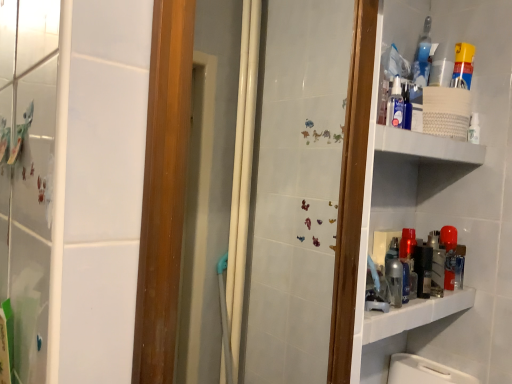
Question: Is yellow plastic spray can at upper right a part of white textured shelf at upper right?

Choices:
 (A) no
 (B) yes

Answer: (A)

Question: Is the depth of white textured shelf at upper right greater than that of yellow plastic spray can at upper right?

Choices:
 (A) no
 (B) yes

Answer: (A)

Question: From the image's perspective, would you say white textured shelf at upper right is shown under yellow plastic spray can at upper right?

Choices:
 (A) no
 (B) yes

Answer: (B)

Question: Considering the relative sizes of white textured shelf at upper right and yellow plastic spray can at upper right in the image provided, is white textured shelf at upper right taller than yellow plastic spray can at upper right?

Choices:
 (A) no
 (B) yes

Answer: (A)

Question: Is white textured shelf at upper right shorter than yellow plastic spray can at upper right?

Choices:
 (A) yes
 (B) no

Answer: (A)

Question: Can you confirm if white textured shelf at upper right is positioned to the left of yellow plastic spray can at upper right?

Choices:
 (A) yes
 (B) no

Answer: (A)

Question: Is yellow plastic spray can at upper right to the left of white textured shelf at upper right from the viewer's perspective?

Choices:
 (A) yes
 (B) no

Answer: (B)

Question: From the image's perspective, does yellow plastic spray can at upper right appear higher than white textured shelf at upper right?

Choices:
 (A) yes
 (B) no

Answer: (A)

Question: Are yellow plastic spray can at upper right and white textured shelf at upper right far apart?

Choices:
 (A) yes
 (B) no

Answer: (B)

Question: Can you confirm if yellow plastic spray can at upper right is wider than white textured shelf at upper right?

Choices:
 (A) no
 (B) yes

Answer: (A)

Question: From the image's perspective, is yellow plastic spray can at upper right beneath white textured shelf at upper right?

Choices:
 (A) no
 (B) yes

Answer: (A)

Question: Is yellow plastic spray can at upper right closer to the viewer compared to white textured shelf at upper right?

Choices:
 (A) yes
 (B) no

Answer: (B)

Question: Is blue glass bottle at upper right smaller than white textured shelf at upper right?

Choices:
 (A) no
 (B) yes

Answer: (B)